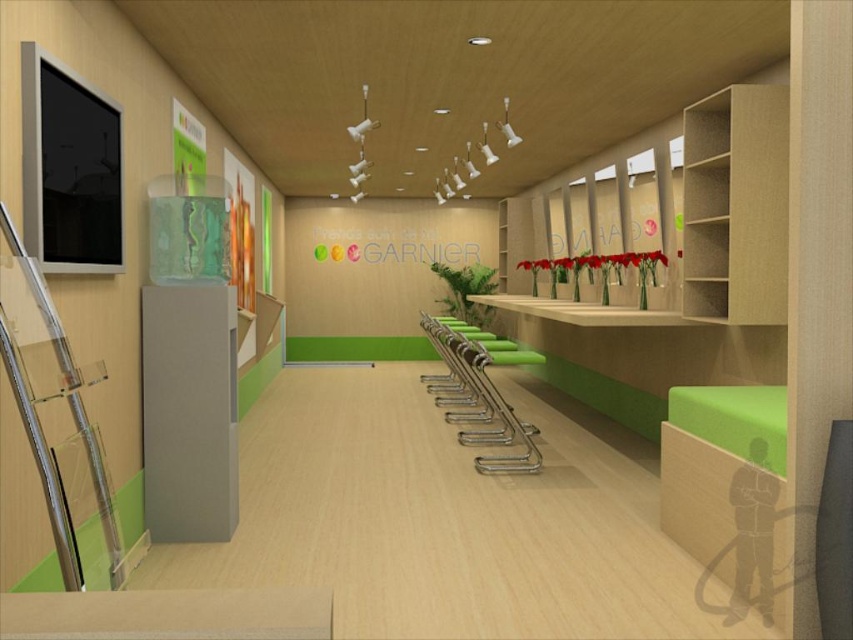
How far apart are clear acrylic ladder at left and green plastic chair at center?

They are 4.23 meters apart.

Who is lower down, clear acrylic ladder at left or green plastic chair at center?

Positioned lower is green plastic chair at center.

Who is more distant from viewer, (41, 292) or (479, 404)?

Point (479, 404)

The height and width of the screenshot is (640, 853). I want to click on clear acrylic ladder at left, so click(x=68, y=412).